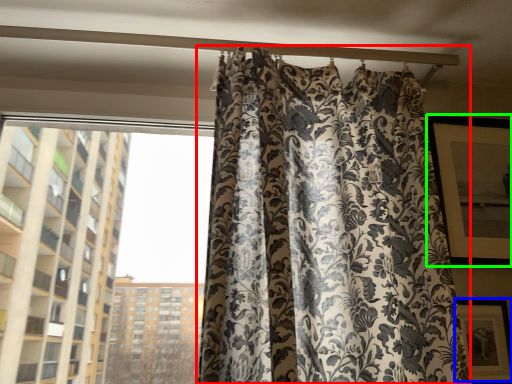
Question: Estimate the real-world distances between objects in this image. Which object is farther from curtain (highlighted by a red box), picture frame (highlighted by a blue box) or window screen (highlighted by a green box)?

Choices:
 (A) picture frame
 (B) window screen

Answer: (A)